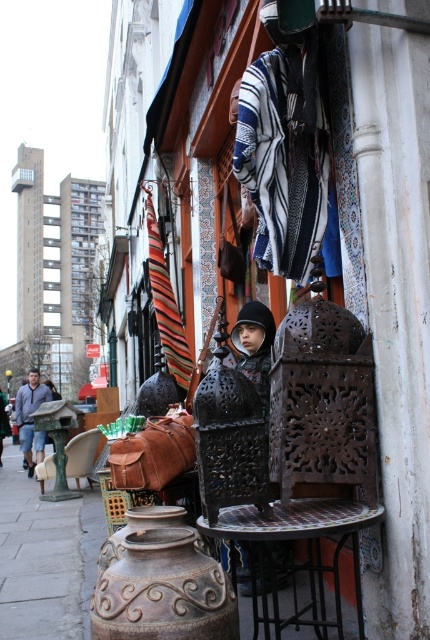
Is denim jacket at left to the right of green fabric chair at center from the viewer's perspective?

No, denim jacket at left is not to the right of green fabric chair at center.

The height and width of the screenshot is (640, 430). What do you see at coordinates (30, 417) in the screenshot?
I see `denim jacket at left` at bounding box center [30, 417].

Identify the location of denim jacket at left. The width and height of the screenshot is (430, 640). (30, 417).

Does rustic metal table at center lie in front of green fabric chair at center?

Yes, it is.

Who is shorter, rustic metal table at center or green fabric chair at center?

rustic metal table at center

Who is more forward, (319, 515) or (74, 442)?

Point (319, 515)

Locate an element on the screen. rustic metal table at center is located at coordinates (298, 564).

Which is more to the right, rustic metal table at center or denim jacket at left?

rustic metal table at center is more to the right.

Locate an element on the screen. This screenshot has width=430, height=640. rustic metal table at center is located at coordinates (298, 564).